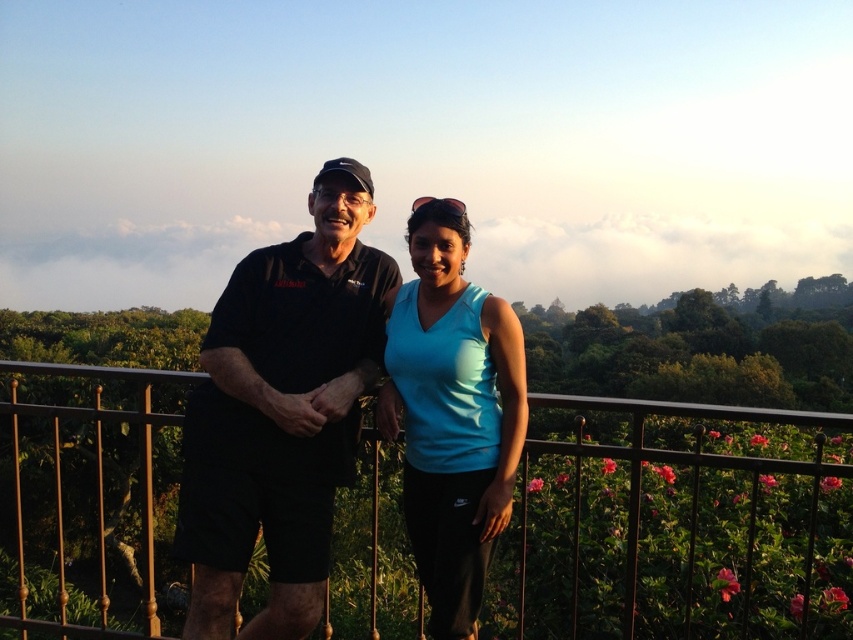
You are a fashion designer who needs to create a new line of clothing. You observe the black fabric shirt at left and the light blue fabric tank top at center in the image. Which of the two garments has a larger size?

The black fabric shirt at left is bigger than the light blue fabric tank top at center, so the black fabric shirt at left has a larger size.

You are trying to locate the black fabric shirt at left in the image. What are the coordinates where you should look?

The black fabric shirt at left is located at coordinates point (281, 412).